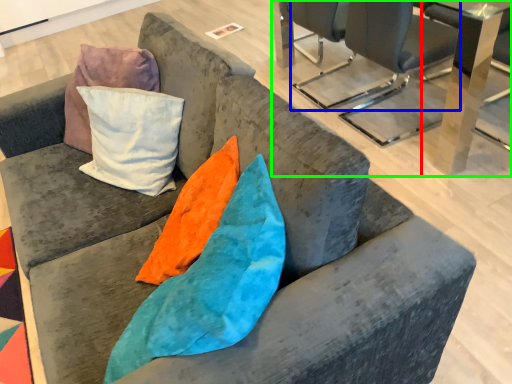
Question: Considering the real-world distances, which object is closest to table (highlighted by a red box)? chair (highlighted by a blue box) or table (highlighted by a green box).

Choices:
 (A) chair
 (B) table

Answer: (B)